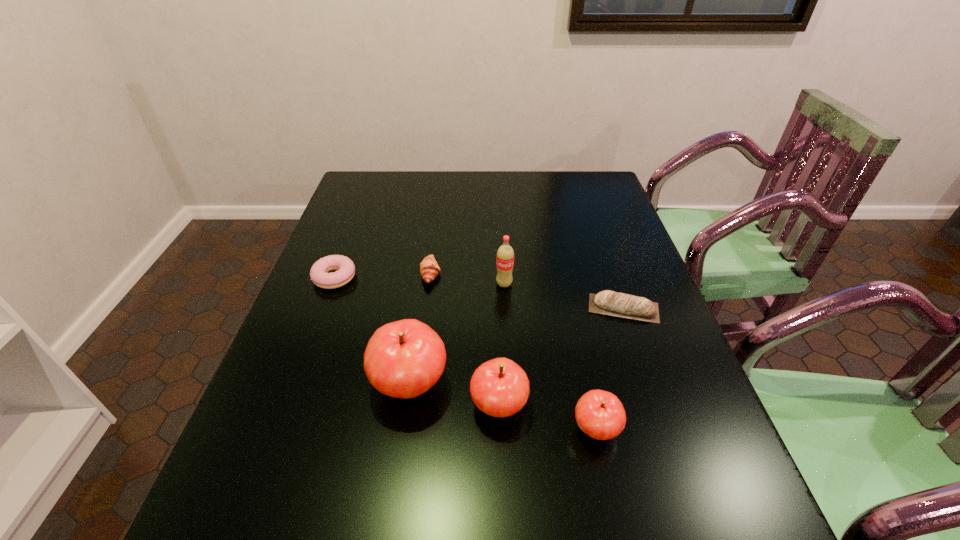
The image size is (960, 540). Find the location of `vacant space situated on the left of the fifth shortest object`. vacant space situated on the left of the fifth shortest object is located at coordinates (329, 406).

Locate an element on the screen. vacant space located 0.330m on the back of the shortest apple is located at coordinates (567, 297).

Image resolution: width=960 pixels, height=540 pixels. In order to click on free space located on the front-facing side of the pastry in this screenshot , I will do `click(488, 274)`.

Where is `free location located on the front of the leftmost object`? free location located on the front of the leftmost object is located at coordinates (324, 306).

The height and width of the screenshot is (540, 960). Find the location of `vacant space located 0.070m on the front of the fourth nearest object`. vacant space located 0.070m on the front of the fourth nearest object is located at coordinates (636, 346).

The height and width of the screenshot is (540, 960). What are the coordinates of `vacant space positioned on the left of the soda` in the screenshot? It's located at (436, 284).

Find the location of `object that is at the near edge`. object that is at the near edge is located at coordinates click(x=600, y=414).

Image resolution: width=960 pixels, height=540 pixels. Identify the location of object present at the left edge. (319, 274).

This screenshot has width=960, height=540. What are the coordinates of `object located at the right edge` in the screenshot? It's located at (607, 302).

In the image, there is a desktop. Identify the location of vacant space at the far edge. pyautogui.click(x=510, y=190).